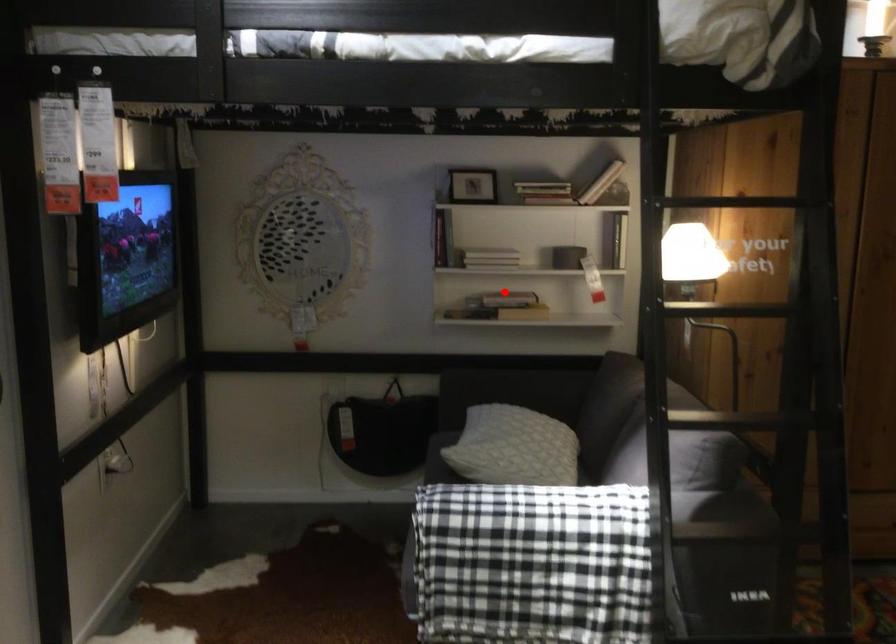
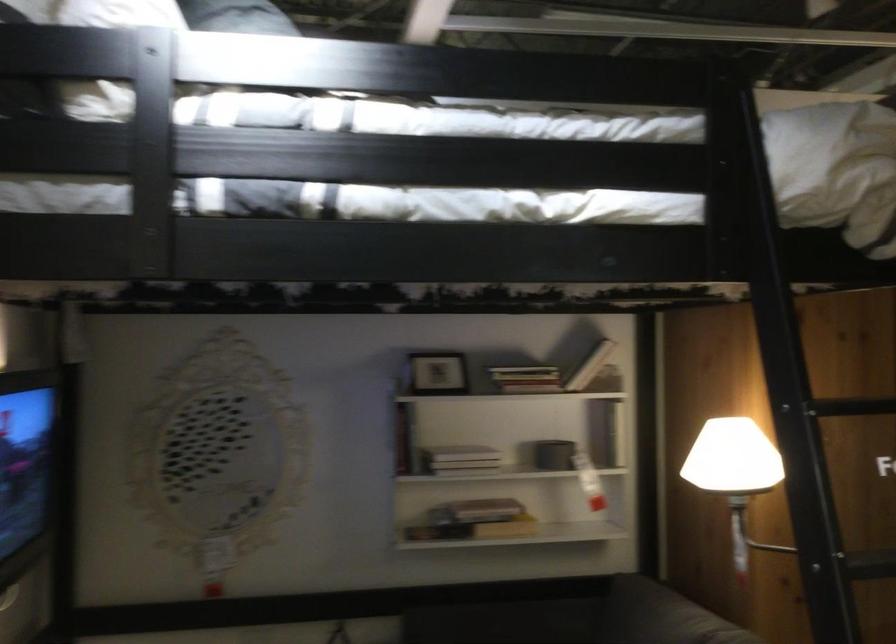
Find the pixel in the second image that matches the highlighted location in the first image.

(476, 511)